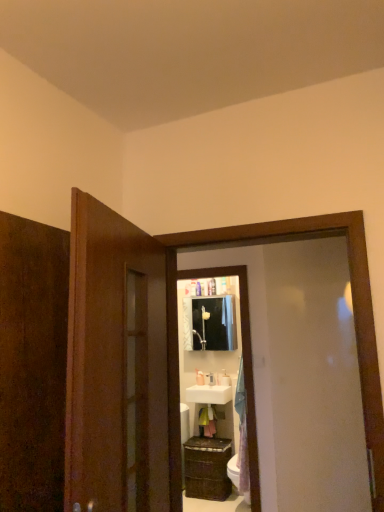
Question: Does matte white medicine cabinet at center lie behind white glossy soap dispenser at center, acting as the second toiletry starting from the right?

Choices:
 (A) no
 (B) yes

Answer: (A)

Question: Is matte white medicine cabinet at center bigger than white glossy soap dispenser at center, acting as the second toiletry starting from the right?

Choices:
 (A) yes
 (B) no

Answer: (A)

Question: Can you see matte white medicine cabinet at center touching white glossy soap dispenser at center, placed as the second toiletry when sorted from left to right?

Choices:
 (A) no
 (B) yes

Answer: (A)

Question: From a real-world perspective, does matte white medicine cabinet at center sit lower than white glossy soap dispenser at center, acting as the second toiletry starting from the right?

Choices:
 (A) no
 (B) yes

Answer: (A)

Question: Is white glossy soap dispenser at center, acting as the second toiletry starting from the right, a part of matte white medicine cabinet at center?

Choices:
 (A) yes
 (B) no

Answer: (B)

Question: Visually, is white glossy toothbrush at upper center, the first toiletry in the right-to-left sequence, positioned to the left or to the right of matte white medicine cabinet at center?

Choices:
 (A) right
 (B) left

Answer: (A)

Question: Relative to matte white medicine cabinet at center, is white glossy toothbrush at upper center, which is counted as the third toiletry, starting from the left, in front or behind?

Choices:
 (A) front
 (B) behind

Answer: (A)

Question: Is white glossy toothbrush at upper center, which is counted as the third toiletry, starting from the left, bigger or smaller than matte white medicine cabinet at center?

Choices:
 (A) small
 (B) big

Answer: (A)

Question: Is point 223,373 closer or farther from the camera than point 185,333?

Choices:
 (A) farther
 (B) closer

Answer: (B)

Question: Looking at the image, does white glossy toilet bowl at lower right seem bigger or smaller compared to white glossy soap dispenser at center, the 1th toiletry in the left-to-right sequence?

Choices:
 (A) small
 (B) big

Answer: (B)

Question: In the image, is white glossy toilet bowl at lower right positioned in front of or behind white glossy soap dispenser at center, acting as the 3th toiletry starting from the right?

Choices:
 (A) behind
 (B) front

Answer: (B)

Question: From the image's perspective, is white glossy toilet bowl at lower right located above or below white glossy soap dispenser at center, the 1th toiletry in the left-to-right sequence?

Choices:
 (A) above
 (B) below

Answer: (B)

Question: Visually, is white glossy toilet bowl at lower right positioned to the left or to the right of white glossy soap dispenser at center, acting as the 3th toiletry starting from the right?

Choices:
 (A) left
 (B) right

Answer: (B)

Question: Choose the correct answer: Is matte white medicine cabinet at center inside white glossy sink at center or outside it?

Choices:
 (A) inside
 (B) outside

Answer: (B)

Question: Is matte white medicine cabinet at center bigger or smaller than white glossy sink at center?

Choices:
 (A) small
 (B) big

Answer: (B)